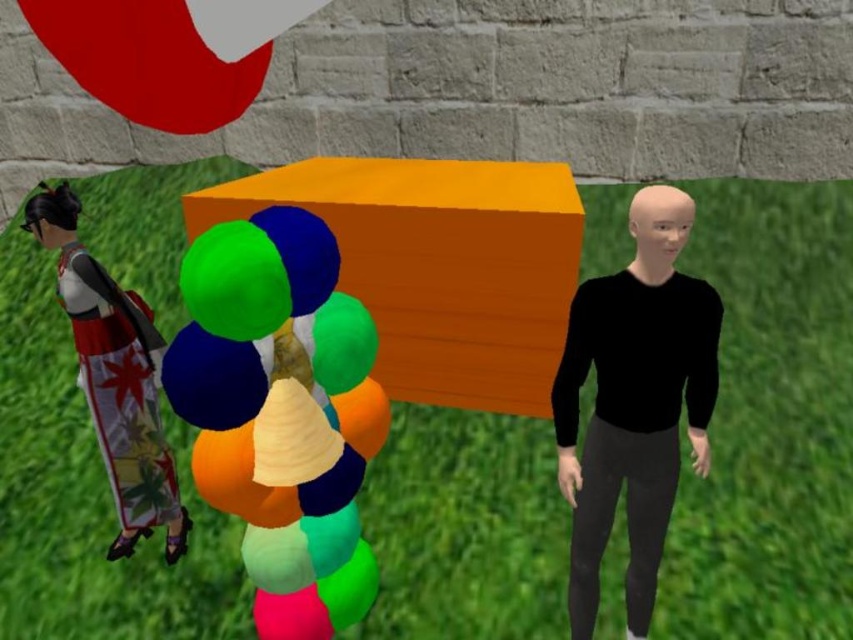
Question: Does satin balloons at center have a smaller size compared to silk kimono doll at left?

Choices:
 (A) no
 (B) yes

Answer: (B)

Question: Which of the following is the farthest from the observer?

Choices:
 (A) (117, 291)
 (B) (653, 376)
 (C) (193, 394)

Answer: (A)

Question: Is satin balloons at center positioned in front of silk kimono doll at left?

Choices:
 (A) yes
 (B) no

Answer: (A)

Question: From the image, what is the correct spatial relationship of black matte mannequin at center in relation to silk kimono doll at left?

Choices:
 (A) above
 (B) below

Answer: (B)

Question: Which of the following is the closest to the observer?

Choices:
 (A) satin balloons at center
 (B) black matte mannequin at center
 (C) silk kimono doll at left

Answer: (A)

Question: Estimate the real-world distances between objects in this image. Which object is farther from the silk kimono doll at left?

Choices:
 (A) black matte mannequin at center
 (B) satin balloons at center

Answer: (A)